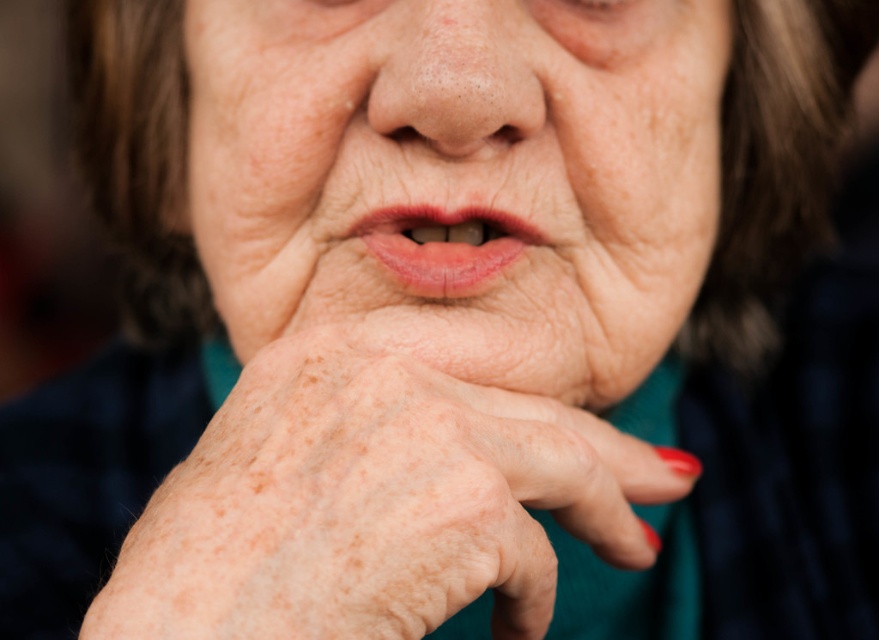
Based on the scene description, which object is taller between the dry skin nose at center and the pink glossy lips at center?

The dry skin nose at center is taller than the pink glossy lips at center according to the description.

You are a photographer holding a camera. You want to take a closeup portrait of the subject. The point at coordinate point (665,93) is part of the subject. If you are currently 63.85 centimeters away from that point, is your camera positioned correctly to capture the subject in focus?

The point at coordinate point (665,93) is 63.85 centimeters away from the camera. Since the photographer is holding the camera at this distance, it is likely positioned correctly to capture the subject in focus, assuming proper focus settings and stability.